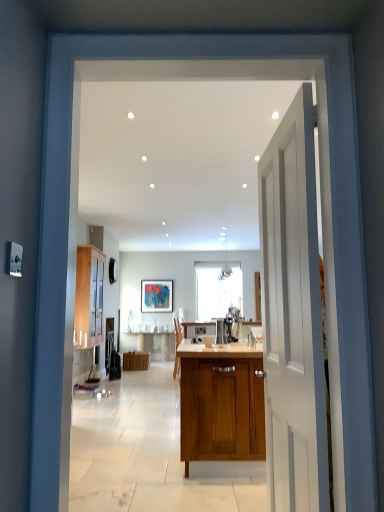
Question: Is satin silver coffee machine at center surrounded by white smooth door at right?

Choices:
 (A) no
 (B) yes

Answer: (A)

Question: Considering the relative sizes of white smooth door at right and satin silver coffee machine at center in the image provided, is white smooth door at right taller than satin silver coffee machine at center?

Choices:
 (A) yes
 (B) no

Answer: (A)

Question: Can you confirm if white smooth door at right is bigger than satin silver coffee machine at center?

Choices:
 (A) yes
 (B) no

Answer: (A)

Question: Is white smooth door at right in front of satin silver coffee machine at center?

Choices:
 (A) no
 (B) yes

Answer: (B)

Question: Considering the relative sizes of white smooth door at right and satin silver coffee machine at center in the image provided, is white smooth door at right wider than satin silver coffee machine at center?

Choices:
 (A) no
 (B) yes

Answer: (A)

Question: From the image's perspective, is satin silver coffee machine at center positioned above or below white smooth door at right?

Choices:
 (A) below
 (B) above

Answer: (A)

Question: Considering the positions of satin silver coffee machine at center and white smooth door at right in the image, is satin silver coffee machine at center taller or shorter than white smooth door at right?

Choices:
 (A) tall
 (B) short

Answer: (B)

Question: In terms of size, does satin silver coffee machine at center appear bigger or smaller than white smooth door at right?

Choices:
 (A) small
 (B) big

Answer: (A)

Question: From a real-world perspective, relative to white smooth door at right, is satin silver coffee machine at center vertically above or below?

Choices:
 (A) below
 (B) above

Answer: (A)

Question: In the image, is wooden cabinet at center, the first cabinetry when ordered from bottom to top, positioned in front of or behind wooden cabinet at left, the first cabinetry viewed from the top?

Choices:
 (A) front
 (B) behind

Answer: (B)

Question: Considering the positions of wooden cabinet at center, which appears as the second cabinetry when viewed from the left, and wooden cabinet at left, the second cabinetry when ordered from right to left, in the image, is wooden cabinet at center, which appears as the second cabinetry when viewed from the left, taller or shorter than wooden cabinet at left, the second cabinetry when ordered from right to left,?

Choices:
 (A) short
 (B) tall

Answer: (A)

Question: Based on their sizes in the image, would you say wooden cabinet at center, the first cabinetry when ordered from bottom to top, is bigger or smaller than wooden cabinet at left, the second cabinetry when ordered from bottom to top?

Choices:
 (A) small
 (B) big

Answer: (A)

Question: Considering the positions of point (125, 370) and point (100, 270), is point (125, 370) closer or farther from the camera than point (100, 270)?

Choices:
 (A) farther
 (B) closer

Answer: (A)

Question: Considering the positions of wooden cabinet at left, the second cabinetry when ordered from bottom to top, and wooden cabinet at center, which appears as the 1th cabinetry when viewed from the right, in the image, is wooden cabinet at left, the second cabinetry when ordered from bottom to top, bigger or smaller than wooden cabinet at center, which appears as the 1th cabinetry when viewed from the right,?

Choices:
 (A) big
 (B) small

Answer: (A)

Question: Based on their positions, is wooden cabinet at left, the second cabinetry from the back, located to the left or right of wooden cabinet at center, which appears as the second cabinetry when viewed from the left?

Choices:
 (A) right
 (B) left

Answer: (B)